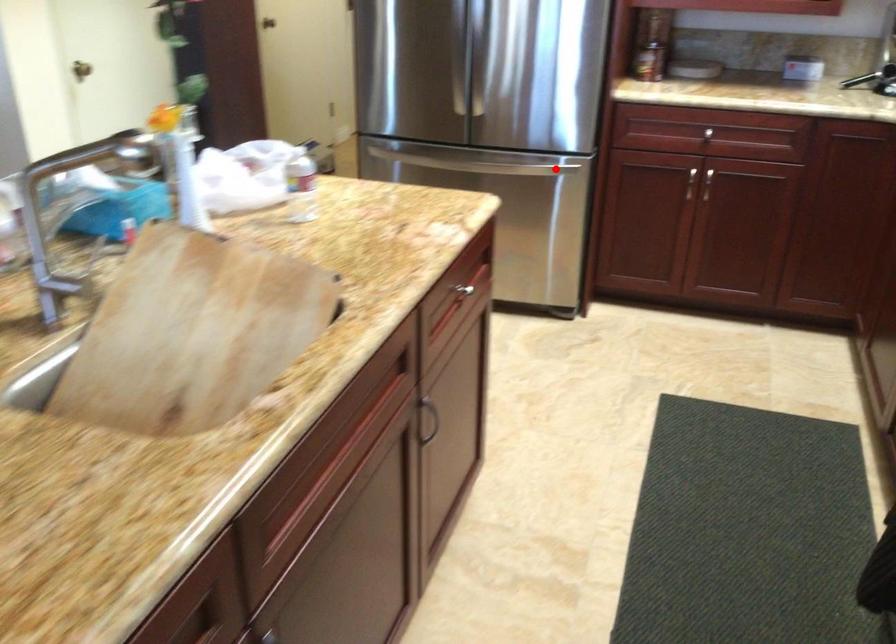
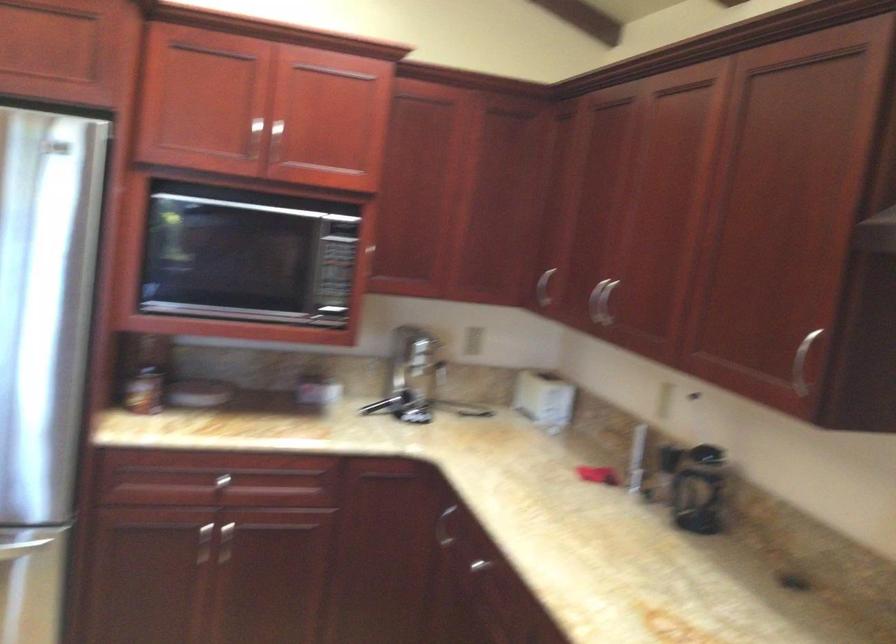
Where in the second image is the point corresponding to the highlighted location from the first image?

(21, 547)